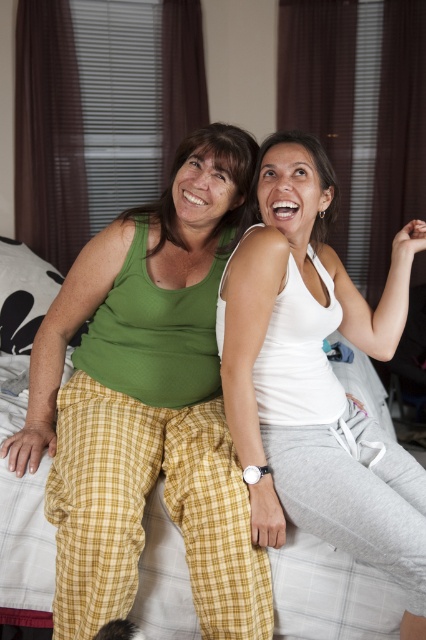
In the scene shown: You are a photographer trying to capture a candid shot of the two people in the image. Your camera has a 10 inch focus range. Can you focus on both the green cotton tank top at center and the white matte tank top at center at the same time?

The green cotton tank top at center and the white matte tank top at center are 9.99 inches apart, so yes, the camera can focus on both since the distance between them is within the 10 inch focus range.

You are designing a new clothing line and need to compare the sizes of two tank tops. You have the green cotton tank top at center and the white matte tank top at center. Which one is taller?

The green cotton tank top at center is taller than the white matte tank top at center.

You are a photographer setting up a photo shoot in the bedroom scene. You need to place a small prop between the green cotton tank top at center and the white matte tank top at center. If the prop requires a minimum space of 15 cm between the two tops, can you determine if there is enough space based on their widths?

The green cotton tank top at center might be wider than white matte tank top at center, but the exact width difference isn